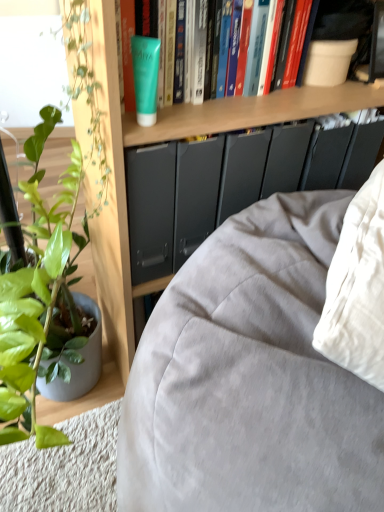
Question: Is green matte tube at upper center at the left side of green matte tube at upper center?

Choices:
 (A) no
 (B) yes

Answer: (B)

Question: Is green matte tube at upper center bigger than green matte tube at upper center?

Choices:
 (A) no
 (B) yes

Answer: (A)

Question: Is green matte tube at upper center positioned far away from green matte tube at upper center?

Choices:
 (A) yes
 (B) no

Answer: (B)

Question: From the image's perspective, is green matte tube at upper center located beneath green matte tube at upper center?

Choices:
 (A) no
 (B) yes

Answer: (B)

Question: Is green matte tube at upper center taller than green matte tube at upper center?

Choices:
 (A) no
 (B) yes

Answer: (A)

Question: From their relative heights in the image, would you say green matte tube at upper center is taller or shorter than matte gray fabric couch at lower left?

Choices:
 (A) tall
 (B) short

Answer: (B)

Question: Is green matte tube at upper center wider or thinner than matte gray fabric couch at lower left?

Choices:
 (A) wide
 (B) thin

Answer: (B)

Question: From the image's perspective, is green matte tube at upper center located above or below matte gray fabric couch at lower left?

Choices:
 (A) below
 (B) above

Answer: (B)

Question: Considering the positions of point (x=301, y=40) and point (x=301, y=210), is point (x=301, y=40) closer or farther from the camera than point (x=301, y=210)?

Choices:
 (A) closer
 (B) farther

Answer: (B)

Question: Considering the positions of point (144, 97) and point (122, 117), is point (144, 97) closer or farther from the camera than point (122, 117)?

Choices:
 (A) farther
 (B) closer

Answer: (B)

Question: Visually, is green matte tube at upper center positioned to the left or to the right of wooden bookshelf at upper center?

Choices:
 (A) left
 (B) right

Answer: (A)

Question: From the image's perspective, is green matte tube at upper center located above or below wooden bookshelf at upper center?

Choices:
 (A) below
 (B) above

Answer: (B)

Question: Is green matte tube at upper center in front of or behind wooden bookshelf at upper center in the image?

Choices:
 (A) behind
 (B) front

Answer: (A)

Question: Based on their positions, is wooden bookshelf at upper center located to the left or right of green matte tube at upper center?

Choices:
 (A) right
 (B) left

Answer: (A)

Question: Is wooden bookshelf at upper center taller or shorter than green matte tube at upper center?

Choices:
 (A) tall
 (B) short

Answer: (A)